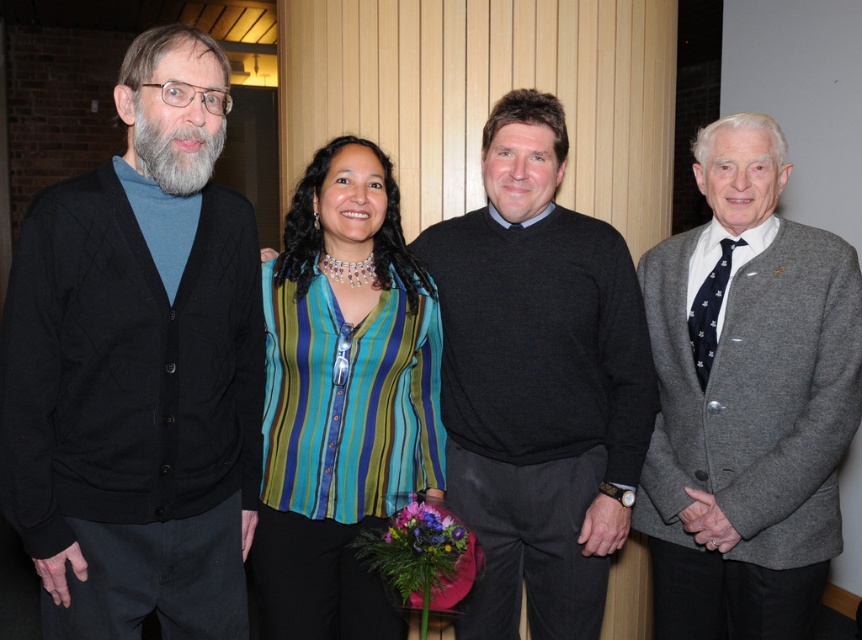
What do you see at coordinates (138, 368) in the screenshot? I see `black cardigan at left` at bounding box center [138, 368].

You are a GUI agent. You are given a task and a screenshot of the screen. Output one action in this format:
    pyautogui.click(x=<x>, y=<y>)
    Task: Click on the black cardigan at left
    This screenshot has width=862, height=640.
    Given the screenshot: What is the action you would take?
    pyautogui.click(x=138, y=368)

Does black cardigan at left come in front of gray wool cardigan at right?

Yes, black cardigan at left is closer to the viewer.

Can you confirm if black cardigan at left is positioned above gray wool cardigan at right?

Correct, black cardigan at left is located above gray wool cardigan at right.

Is point (216, 536) farther from viewer compared to point (770, 630)?

No, (216, 536) is in front of (770, 630).

Find the location of a particular element. Image resolution: width=862 pixels, height=640 pixels. black cardigan at left is located at coordinates (138, 368).

Can you confirm if black cardigan at left is shorter than striped fabric blouse at center?

No.

Who is taller, black cardigan at left or striped fabric blouse at center?

Standing taller between the two is black cardigan at left.

Identify the location of black cardigan at left. (138, 368).